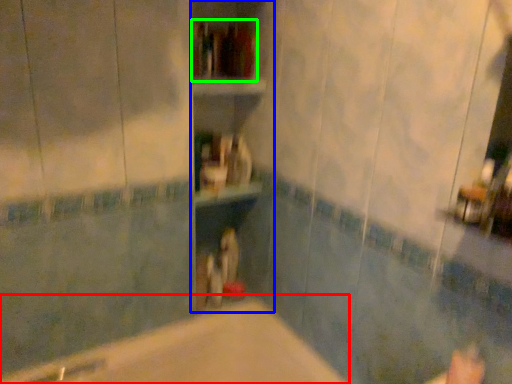
Question: Which is farther away from bathtub (highlighted by a red box)? bookshelf (highlighted by a blue box) or book (highlighted by a green box)?

Choices:
 (A) bookshelf
 (B) book

Answer: (B)